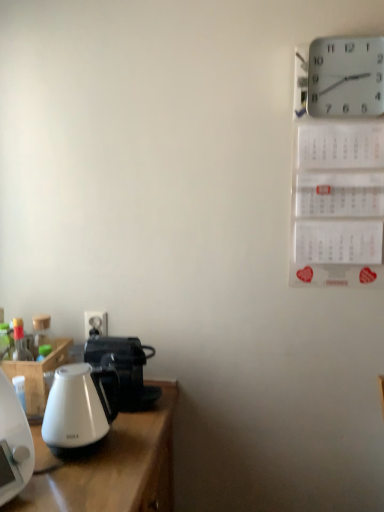
Find the location of a particular element. free spot above white glossy kettle at left (from a real-world perspective) is located at coordinates (72, 375).